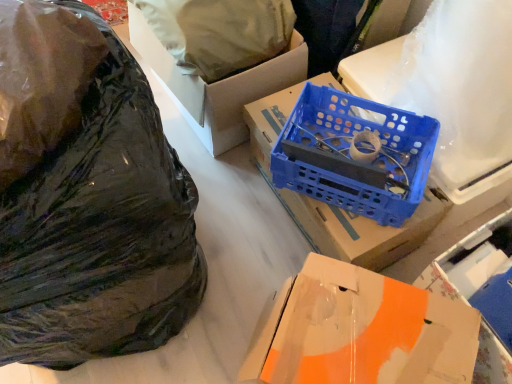
Question: Can you confirm if black matte plastic bag at left, which is counted as the 2th plastic bag, starting from the back, is smaller than blue plastic crate at center, arranged as the second box when viewed from the top?

Choices:
 (A) yes
 (B) no

Answer: (B)

Question: Can you confirm if black matte plastic bag at left, which is counted as the 2th plastic bag, starting from the back, is wider than blue plastic crate at center, arranged as the second box when viewed from the top?

Choices:
 (A) yes
 (B) no

Answer: (A)

Question: Can you confirm if black matte plastic bag at left, which is counted as the 2th plastic bag, starting from the back, is shorter than blue plastic crate at center, arranged as the second box when viewed from the top?

Choices:
 (A) no
 (B) yes

Answer: (A)

Question: Can we say black matte plastic bag at left, which is counted as the 2th plastic bag, starting from the back, lies outside blue plastic crate at center, which appears as the second box when ordered from the bottom?

Choices:
 (A) no
 (B) yes

Answer: (B)

Question: From the image's perspective, is black matte plastic bag at left, the first plastic bag in the front-to-back sequence, over blue plastic crate at center, arranged as the second box when viewed from the top?

Choices:
 (A) no
 (B) yes

Answer: (A)

Question: Would you say cardboard box at center, which ranks as the third box in bottom-to-top order, is inside or outside blue plastic wire at center?

Choices:
 (A) outside
 (B) inside

Answer: (A)

Question: Is point (250, 99) closer or farther from the camera than point (397, 185)?

Choices:
 (A) farther
 (B) closer

Answer: (A)

Question: Considering their positions, is cardboard box at center, which ranks as the third box in bottom-to-top order, located in front of or behind blue plastic wire at center?

Choices:
 (A) front
 (B) behind

Answer: (B)

Question: Is cardboard box at center, which ranks as the third box in bottom-to-top order, bigger or smaller than blue plastic wire at center?

Choices:
 (A) big
 (B) small

Answer: (A)

Question: Is point (473, 127) closer or farther from the camera than point (64, 231)?

Choices:
 (A) farther
 (B) closer

Answer: (A)

Question: Considering the relative positions of white matte wrapping paper at upper right, acting as the 1th wrapping paper starting from the right, and black matte plastic bag at left, the first plastic bag in the front-to-back sequence, in the image provided, is white matte wrapping paper at upper right, acting as the 1th wrapping paper starting from the right, to the left or to the right of black matte plastic bag at left, the first plastic bag in the front-to-back sequence,?

Choices:
 (A) left
 (B) right

Answer: (B)

Question: Relative to black matte plastic bag at left, the first plastic bag in the front-to-back sequence, is white matte wrapping paper at upper right, acting as the 1th wrapping paper starting from the right, in front or behind?

Choices:
 (A) behind
 (B) front

Answer: (A)

Question: Is white matte wrapping paper at upper right, arranged as the second wrapping paper when viewed from the left, taller or shorter than black matte plastic bag at left, which is counted as the 2th plastic bag, starting from the back?

Choices:
 (A) tall
 (B) short

Answer: (B)

Question: Considering the relative positions of blue plastic wire at center and white matte wrapping paper at upper right, acting as the 1th wrapping paper starting from the right, in the image provided, is blue plastic wire at center to the left or to the right of white matte wrapping paper at upper right, acting as the 1th wrapping paper starting from the right,?

Choices:
 (A) right
 (B) left

Answer: (B)

Question: Looking at their shapes, would you say blue plastic wire at center is wider or thinner than white matte wrapping paper at upper right, arranged as the second wrapping paper when viewed from the left?

Choices:
 (A) wide
 (B) thin

Answer: (B)